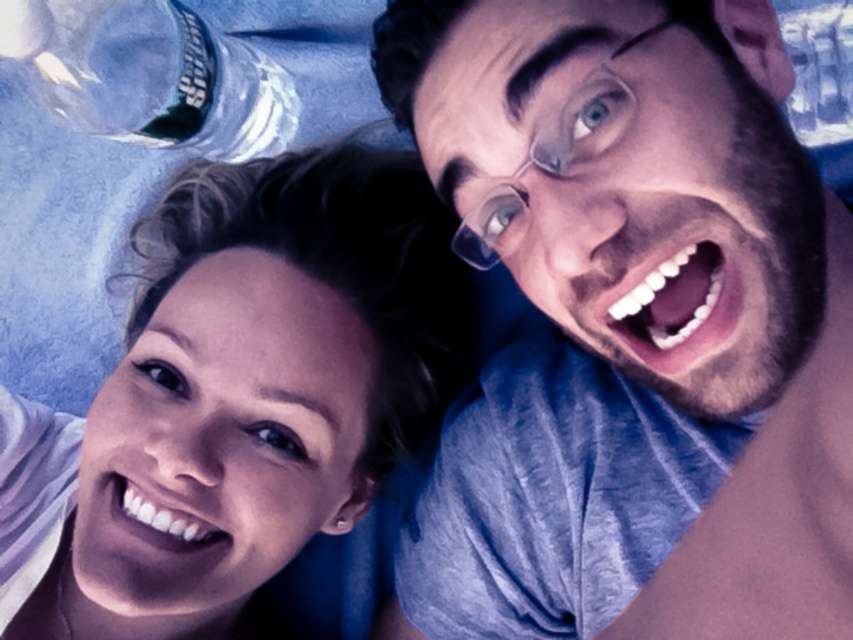
Does matte blue shirt at upper right appear over clear plastic glasses at upper center?

Yes.

Can you confirm if matte blue shirt at upper right is smaller than clear plastic glasses at upper center?

Actually, matte blue shirt at upper right might be larger than clear plastic glasses at upper center.

Is point (544, 67) less distant than point (599, 84)?

That is False.

The height and width of the screenshot is (640, 853). Identify the location of matte blue shirt at upper right. (625, 177).

Can you confirm if matte white face at center is positioned below clear plastic bottle at upper left?

Yes, matte white face at center is below clear plastic bottle at upper left.

Is matte white face at center closer to camera compared to clear plastic bottle at upper left?

Yes, matte white face at center is closer to the viewer.

Where is `matte white face at center`? matte white face at center is located at coordinates (235, 397).

Identify the location of matte white face at center. (235, 397).

Can you confirm if matte white face at center is wider than matte blue shirt at upper right?

Yes.

Can you confirm if matte white face at center is smaller than matte blue shirt at upper right?

No.

Which is behind, point (171, 451) or point (570, 257)?

The point (171, 451) is behind.

In order to click on matte white face at center in this screenshot , I will do (x=235, y=397).